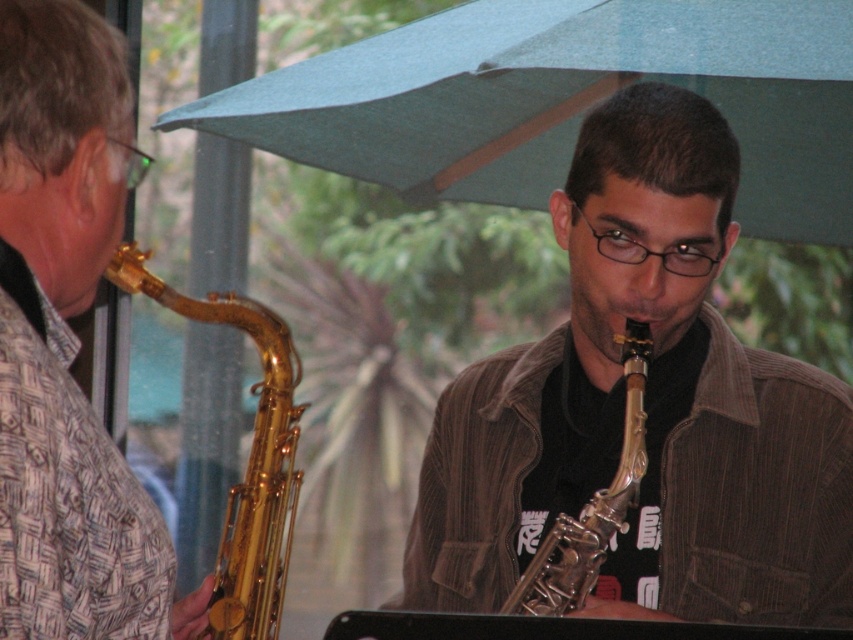
Question: Estimate the real-world distances between objects in this image. Which object is closer to the matte gold saxophone at left?

Choices:
 (A) gold shiny saxophone at center
 (B) gold polished saxophone at left
 (C) green fabric umbrella at upper center
 (D) shiny silver saxophone at center

Answer: (B)

Question: Is the position of shiny silver saxophone at center more distant than that of gold polished saxophone at left?

Choices:
 (A) no
 (B) yes

Answer: (B)

Question: Which of the following is the closest to the observer?

Choices:
 (A) (776, 196)
 (B) (274, 336)
 (C) (611, 496)

Answer: (C)

Question: Which point is farther from the camera taking this photo?

Choices:
 (A) (717, 125)
 (B) (271, 628)
 (C) (422, 148)
 (D) (560, 566)

Answer: (C)

Question: Can you confirm if matte gold saxophone at left is positioned to the left of gold shiny saxophone at center?

Choices:
 (A) yes
 (B) no

Answer: (A)

Question: Does matte gold saxophone at left appear on the right side of gold polished saxophone at left?

Choices:
 (A) yes
 (B) no

Answer: (B)